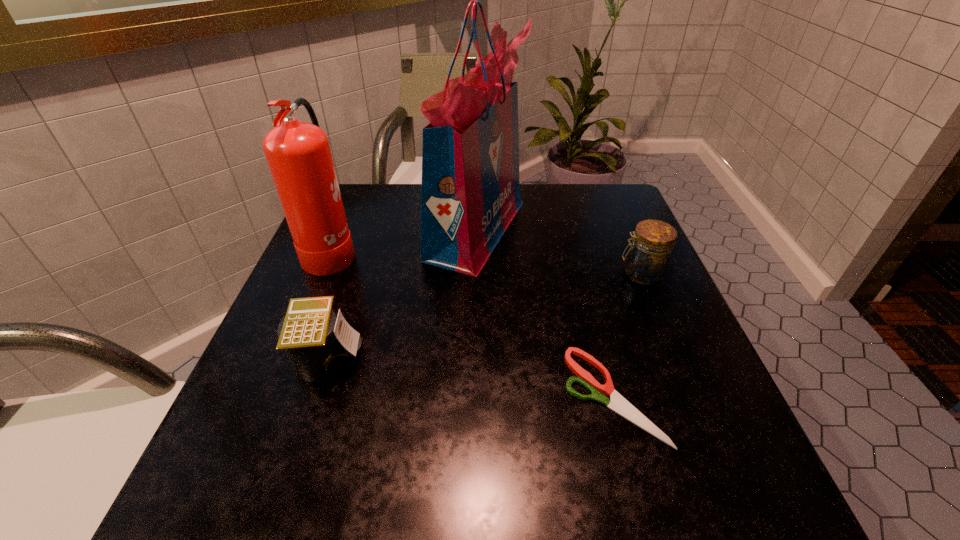
Identify the location of free space that satisfies the following two spatial constraints: 1. towards the nozzle of the second shortest object; 2. on the right side of the fire extinguisher. (287, 359).

In order to click on free space that satisfies the following two spatial constraints: 1. on the front-facing side of the scissors; 2. on the right side of the grocery bag in this screenshot , I will do `click(474, 395)`.

Where is `free location that satisfies the following two spatial constraints: 1. on the lid of the rightmost object; 2. on the front side of the fourth object from left to right`? The image size is (960, 540). free location that satisfies the following two spatial constraints: 1. on the lid of the rightmost object; 2. on the front side of the fourth object from left to right is located at coordinates (692, 395).